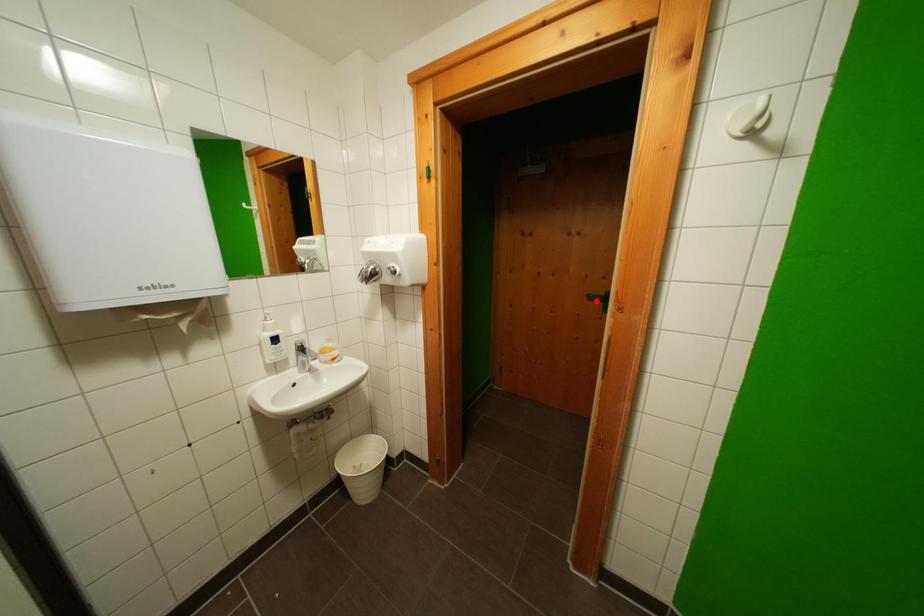
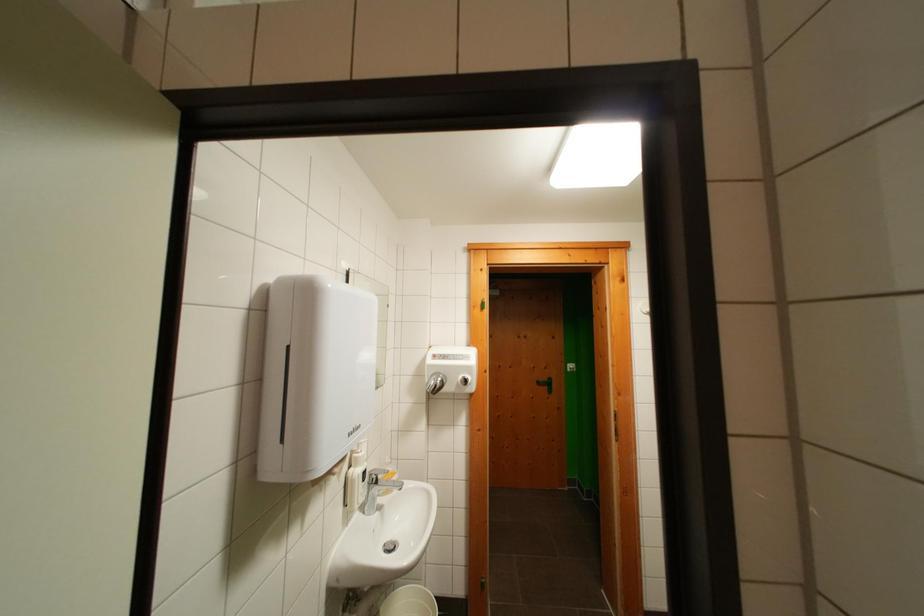
Question: I am providing you with two images of the same scene from different viewpoints. A red point is shown in image1. For the corresponding object point in image2, is it positioned nearer or farther from the camera?

Choices:
 (A) Nearer
 (B) Farther

Answer: (B)